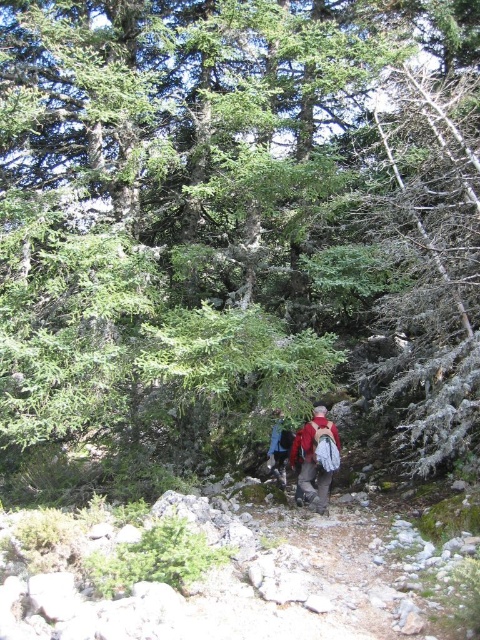
You are a hiker who needs to quickly identify your backpack. You have a red backpack at center and a blue fabric backpack at center. According to the scene, which backpack is located to the right of the other?

The red backpack at center is positioned on the right side of blue fabric backpack at center, so the red backpack is to the right of the blue one.

You are a hiker who wants to ensure your backpack is visible to your partner. You see the red backpack at center and the blue fabric backpack at center. Which backpack is positioned lower on your line of sight?

The red backpack at center is located below the blue fabric backpack at center, so it is positioned lower on your line of sight.

You are a hiker trying to decide which backpack to take for a short day hike. Both the red backpack at center and the blue fabric backpack at center are available. Considering their sizes, which one might be more suitable for carrying just a water bottle and snacks?

The red backpack at center has a lesser height compared to the blue fabric backpack at center, so it might be more suitable for carrying just a water bottle and snacks as it is smaller and lighter.